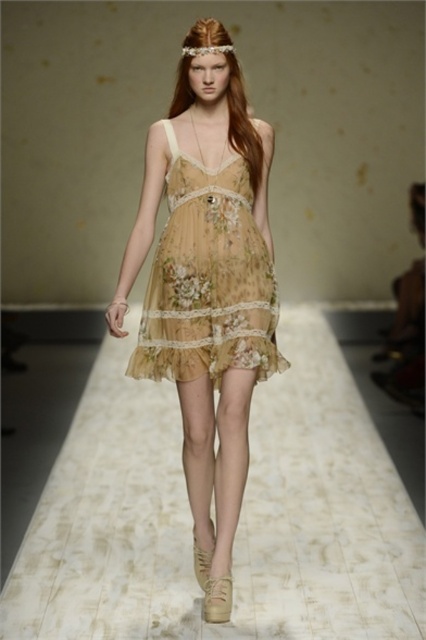
Between translucent floral dress at center and floral chiffon dress at center, which one is positioned lower?

translucent floral dress at center

Is point (241, 131) positioned behind point (199, 371)?

No, (241, 131) is in front of (199, 371).

Is point (206, 186) in front of point (264, 301)?

That is True.

This screenshot has height=640, width=426. Identify the location of translucent floral dress at center. (207, 285).